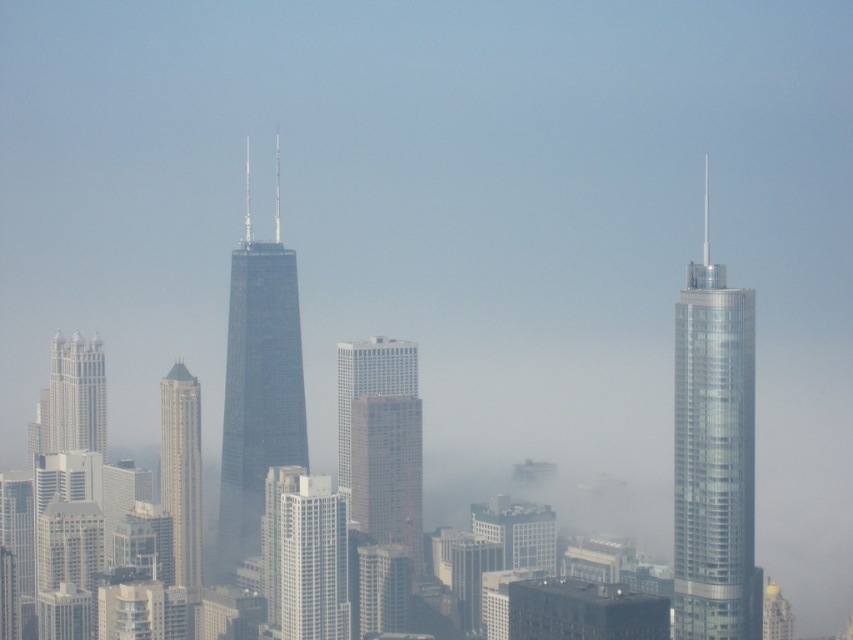
Question: Can you confirm if clear glass skyscraper at right is positioned to the left of dark glass skyscraper at center?

Choices:
 (A) no
 (B) yes

Answer: (A)

Question: Which object is closer to the camera taking this photo?

Choices:
 (A) dark glass skyscraper at center
 (B) matte glass skyscraper at left
 (C) white glossy building at left

Answer: (A)

Question: Among these objects, which one is nearest to the camera?

Choices:
 (A) clear glass skyscraper at right
 (B) white glossy building at left
 (C) white glass building at center
 (D) white textured building at center

Answer: (D)

Question: Among these points, which one is nearest to the camera?

Choices:
 (A) (740, 470)
 (B) (177, 500)

Answer: (B)

Question: Does clear glass skyscraper at right appear over white textured building at center?

Choices:
 (A) no
 (B) yes

Answer: (B)

Question: Can you confirm if clear glass skyscraper at right is thinner than white glossy building at left?

Choices:
 (A) yes
 (B) no

Answer: (B)